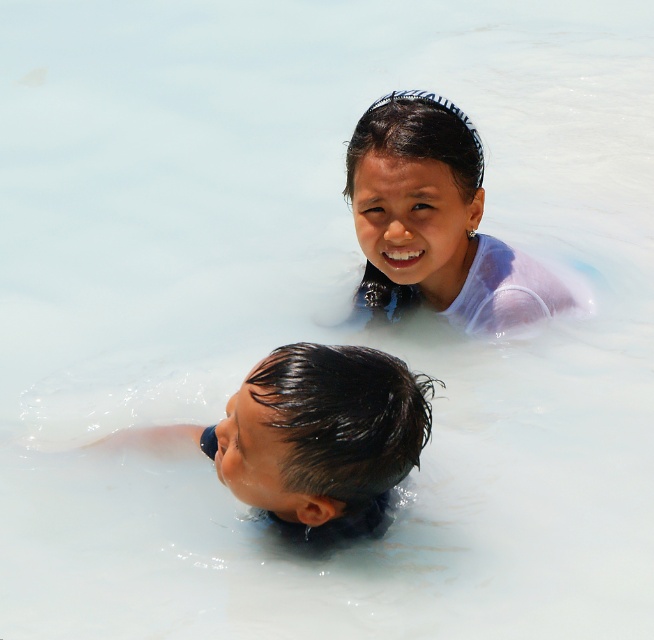
You are a photographer trying to capture the perfect shot of the two children in the water. You want to ensure both the wet black hair at lower center and the white matte hair at upper center are clearly visible in the frame. Based on their positions, which child should you focus on first to ensure both are in focus?

You should focus on the wet black hair at lower center first because it is closer to the camera than the white matte hair at upper center, ensuring both will be in focus when focusing on the closer subject first.

You are a lifeguard observing the scene. There is a point at coordinates (313, 438). Based on the scene description, what object is this point located on?

The point at coordinates (313, 438) is located on the wet black hair at lower center.

You are a photographer taking a picture of the two children in the water. You notice the wet black hair at lower center and the white matte hair at upper center. Which child has hair that appears taller in the photo?

The white matte hair at upper center appears taller than the wet black hair at lower center in the photo.